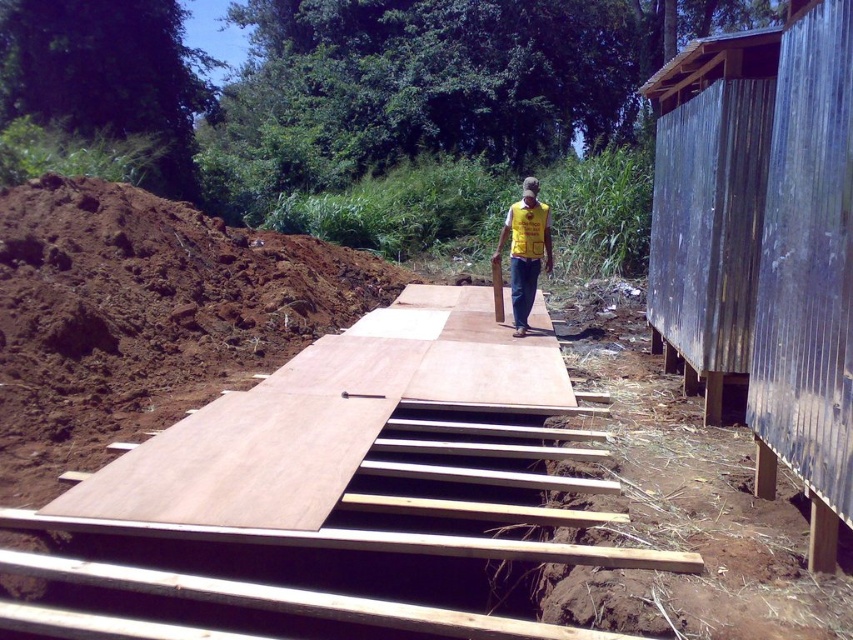
Consider the image. You are a construction worker standing on the wooden platform. You need to place a heavy tool on the nearest stable surface. Which object between the metallic corrugated hut at right and the yellow fabric vest at center should you choose?

The metallic corrugated hut at right is located below the yellow fabric vest at center, so the metallic corrugated hut at right is the stable surface to place the tool.

You are a construction worker who needs to move a heavy tool from the metallic corrugated hut at right to the yellow fabric vest at center. Can you carry it without needing to walk more than 3 meters?

The metallic corrugated hut at right and yellow fabric vest at center are 3.09 meters apart, so you would need to walk more than 3 meters to carry the tool from the metallic corrugated hut at right to the yellow fabric vest at center.